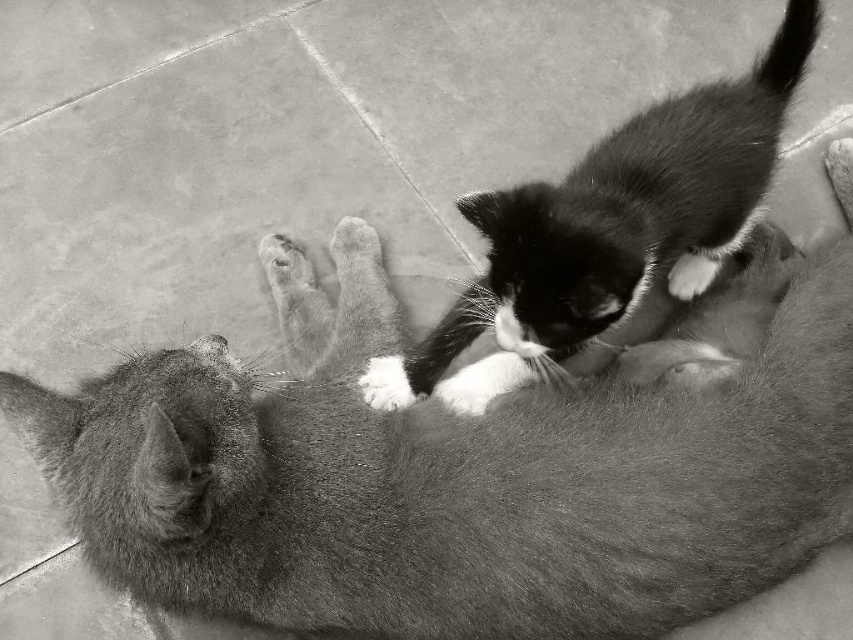
You are a photographer standing 1.2 meters away from the camera. You want to take a closeup shot of the soft fur cat at center. Can you reach the cat without moving your feet?

The soft fur cat at center and camera are 1.17 meters apart. Since you are 1.2 meters away from the camera, the total distance between you and the soft fur cat at center is 1.17 meters plus 1.2 meters, totaling 2.37 meters. This distance is too far to reach the cat without moving your feet.

You are a photographer trying to capture the interaction between the two cats in the image. To ensure both the soft fur cat at center and the white fur paw at upper center are in focus, you need to know their relative sizes. Which one is larger?

The soft fur cat at center is much taller than the white fur paw at upper center, so it is larger.

You are a photographer trying to capture the interaction between the two cats in the image. You want to ensure the soft fur kitten at center and the fuzzy fur paw at center are both clearly visible. Based on their positions, which one is closer to the camera?

The soft fur kitten at center is positioned over the fuzzy fur paw at center, so the soft fur kitten at center is closer to the camera.